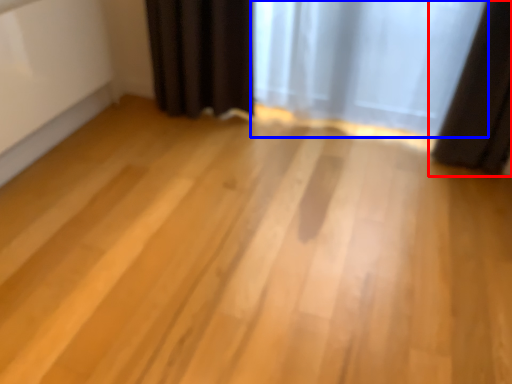
Question: Which object is closer to the camera taking this photo, curtain (highlighted by a red box) or curtain (highlighted by a blue box)?

Choices:
 (A) curtain
 (B) curtain

Answer: (A)